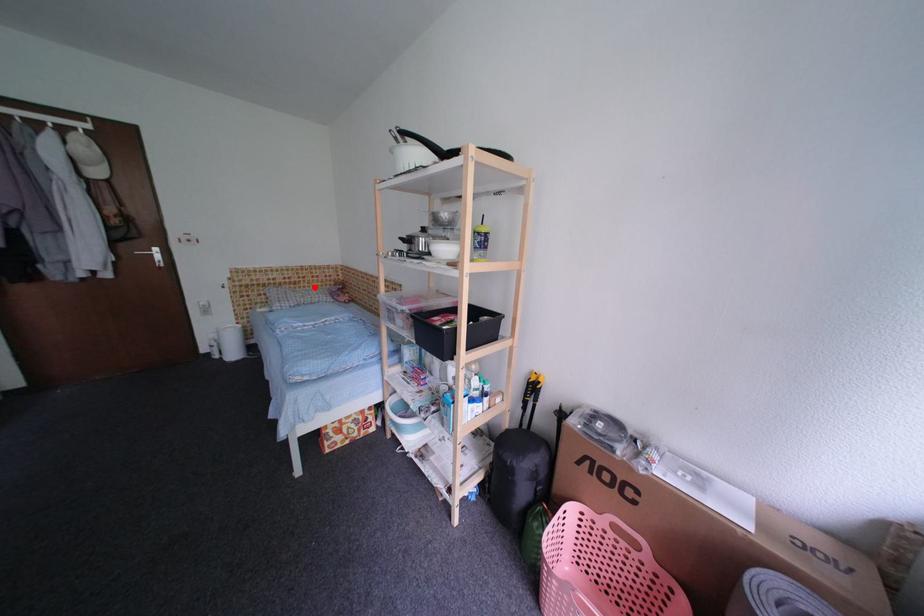
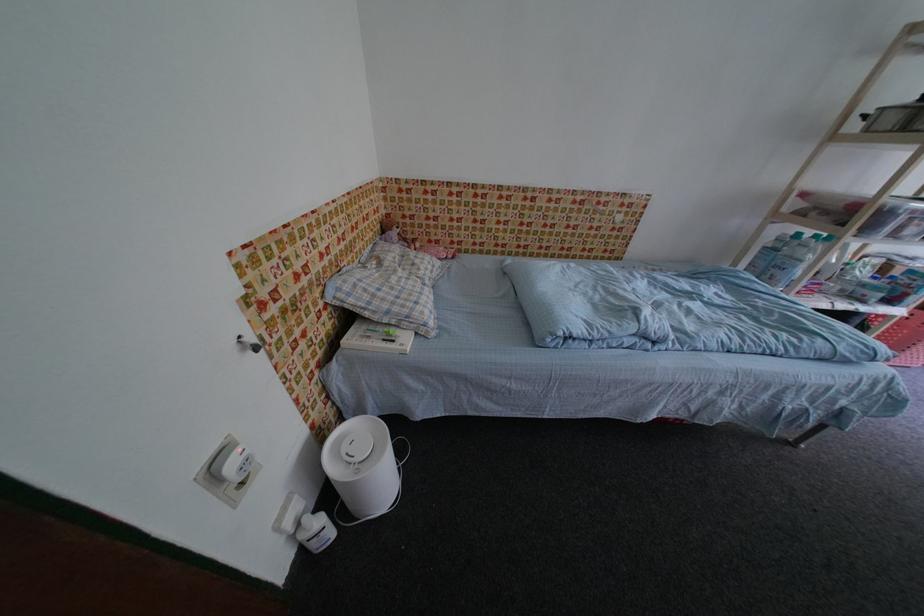
Where in the second image is the point corresponding to the highlighted location from the first image?

(370, 246)